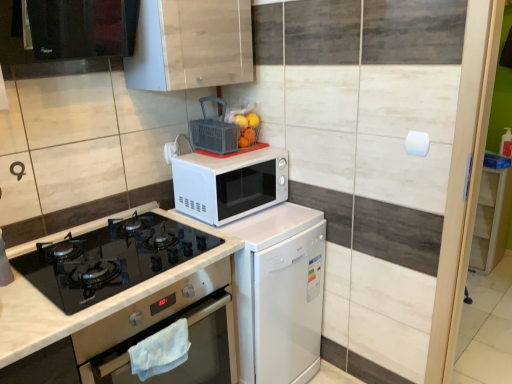
Image resolution: width=512 pixels, height=384 pixels. In order to click on vacant area that is situated to the right of matte plastic basket at upper center, which ranks as the second appliance in left-to-right order in this screenshot , I will do `click(255, 148)`.